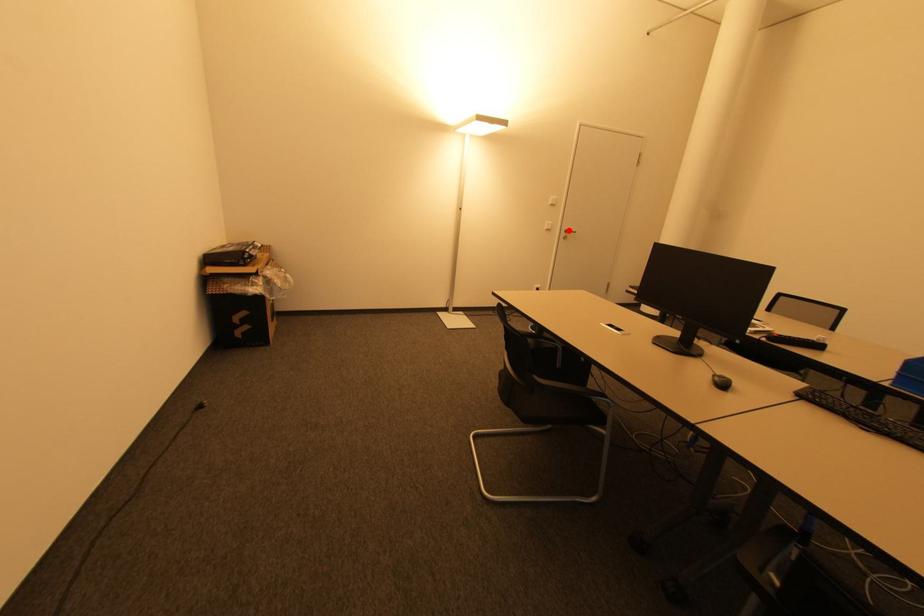
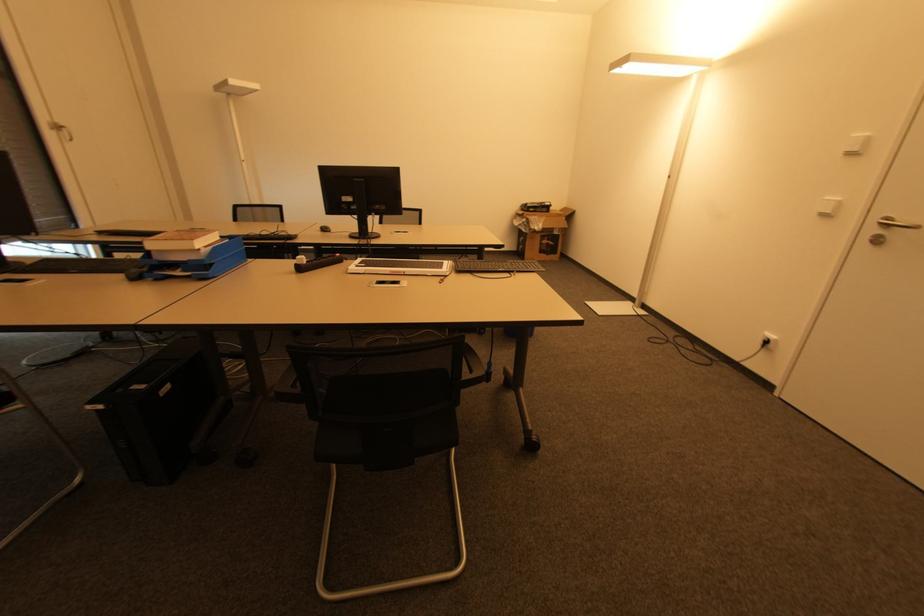
Question: I am providing you with two images of the same scene from different viewpoints. Image1 has a red point marked. In image2, the corresponding 3D location appears at what relative position? Reply with the corresponding letter.

Choices:
 (A) Closer
 (B) Farther

Answer: (B)